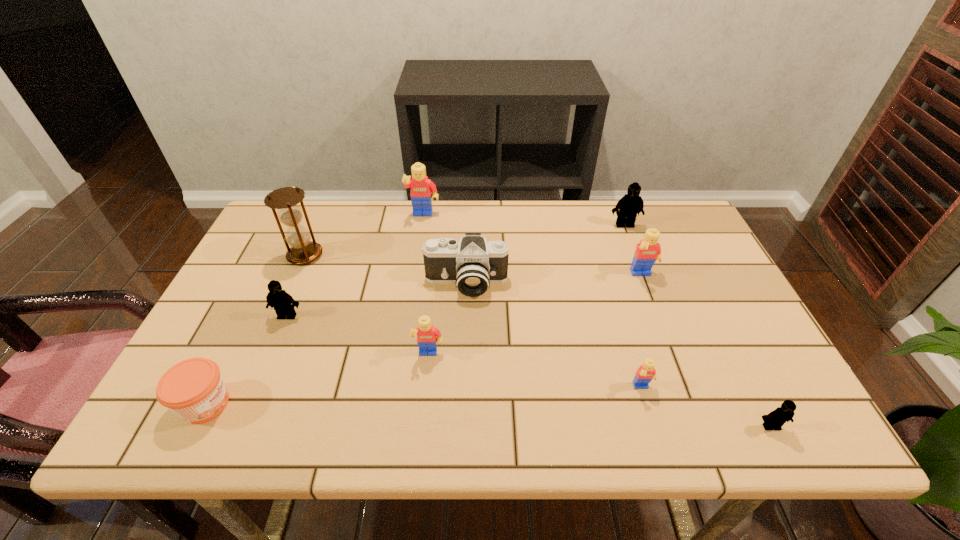
Locate an element on the screen. The height and width of the screenshot is (540, 960). vacant space at the right edge is located at coordinates (704, 281).

Find the location of `blank area at the far left corner`. blank area at the far left corner is located at coordinates click(x=278, y=234).

Find the location of a particular element. This screenshot has width=960, height=540. empty space between the seventh farthest object and the brown hourglass is located at coordinates pos(367,305).

This screenshot has height=540, width=960. I want to click on unoccupied area between the fifth farthest Lego and the third nearest yellow Lego, so click(536, 315).

At what (x,y) coordinates should I click in order to perform the action: click on free spot between the fifth farthest Lego and the biggest black Lego. Please return your answer as a coordinate pair (x, y). The image size is (960, 540). Looking at the image, I should click on (527, 290).

The image size is (960, 540). Identify the location of vacant point located between the second tallest object and the third nearest Lego. (426, 286).

This screenshot has width=960, height=540. Find the location of `vacant area between the tallest Lego and the jam`. vacant area between the tallest Lego and the jam is located at coordinates (315, 310).

Find the location of a particular element. The image size is (960, 540). empty location between the third farthest object and the rightmost object is located at coordinates (538, 341).

Locate an element on the screen. object that is the second closest to the jam is located at coordinates click(x=302, y=251).

Locate which object is the fourth closest to the second nearest black Lego. Please provide its 2D coordinates. Your answer should be formatted as a tuple, i.e. [(x, y)], where the tuple contains the x and y coordinates of a point satisfying the conditions above.

[(428, 336)]